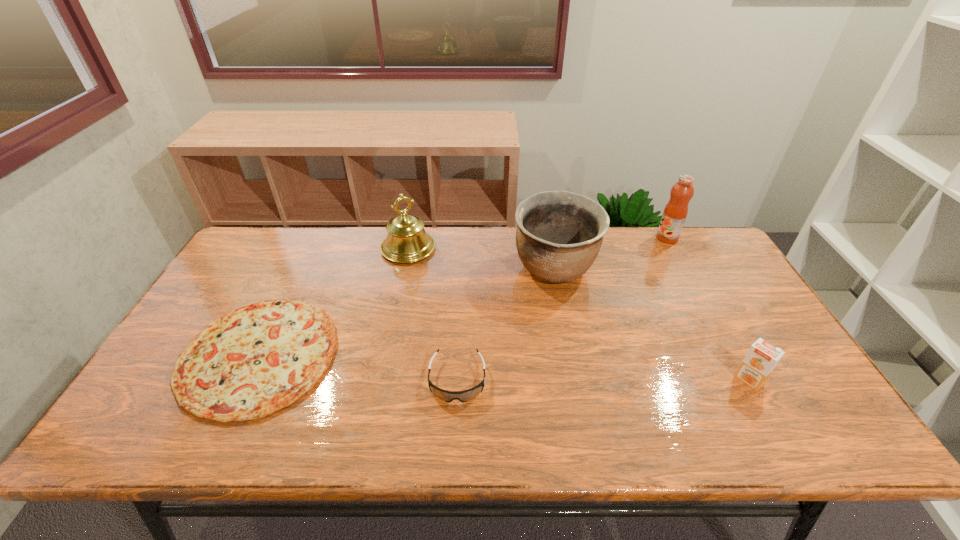
The image size is (960, 540). I want to click on fruit juice, so click(x=675, y=212).

Locate an element on the screen. The width and height of the screenshot is (960, 540). the third object from right to left is located at coordinates (559, 234).

The image size is (960, 540). What are the coordinates of `bell` in the screenshot? It's located at (407, 241).

Locate an element on the screen. The height and width of the screenshot is (540, 960). the fourth tallest object is located at coordinates (761, 359).

Find the location of a particular element. This screenshot has height=540, width=960. the fifth tallest object is located at coordinates pyautogui.click(x=448, y=396).

The image size is (960, 540). I want to click on the fourth object from right to left, so click(448, 396).

This screenshot has width=960, height=540. I want to click on the shortest object, so click(255, 360).

At what (x,y) coordinates should I click in order to perform the action: click on the leftmost object. Please return your answer as a coordinate pair (x, y). Looking at the image, I should click on (255, 360).

Locate an element on the screen. free space located on the front label of the fruit juice is located at coordinates (613, 238).

Identify the location of vacant space located on the front label of the fruit juice. (611, 238).